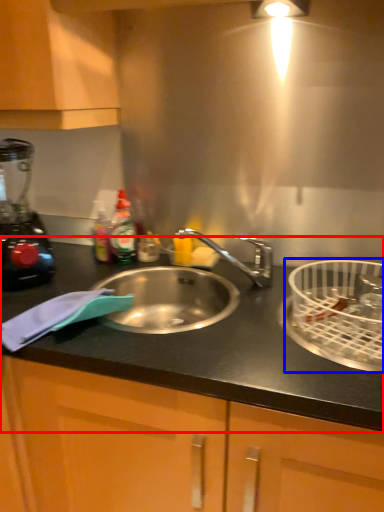
Question: Which of the following is the closest to the observer, countertop (highlighted by a red box) or basket (highlighted by a blue box)?

Choices:
 (A) countertop
 (B) basket

Answer: (A)